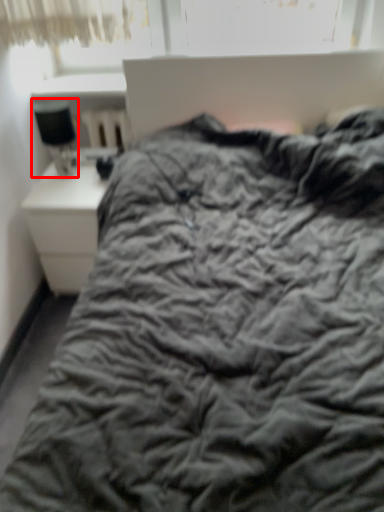
Question: Observing the image, what is the correct spatial positioning of table lamp (annotated by the red box) in reference to nightstand?

Choices:
 (A) right
 (B) left

Answer: (B)